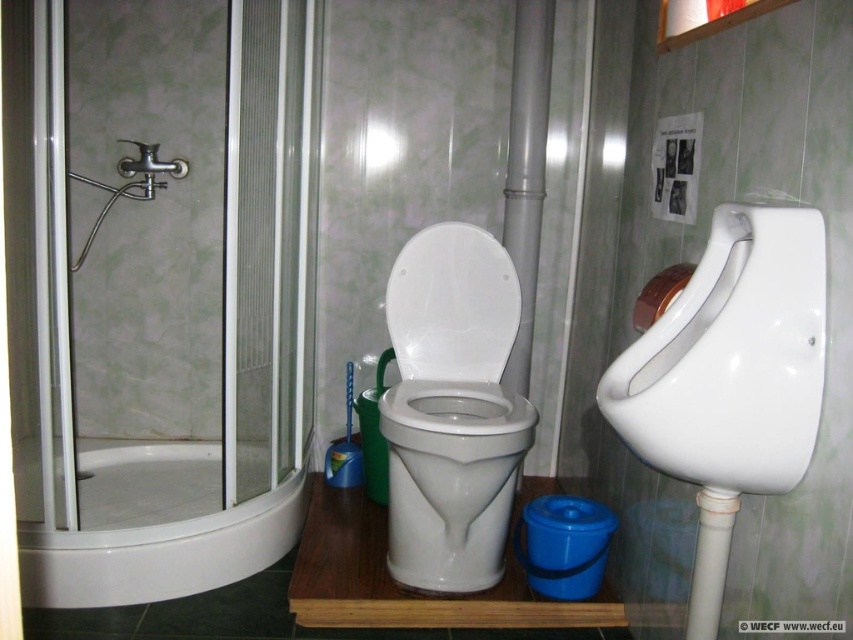
Can you confirm if white glossy toilet bowl at center is wider than brushed metal faucet at upper left?

Yes, white glossy toilet bowl at center is wider than brushed metal faucet at upper left.

Who is positioned more to the right, white glossy toilet bowl at center or brushed metal faucet at upper left?

white glossy toilet bowl at center is more to the right.

Locate an element on the screen. The image size is (853, 640). white glossy toilet bowl at center is located at coordinates pyautogui.click(x=451, y=410).

I want to click on white glossy toilet bowl at center, so click(451, 410).

Is point (474, 253) closer to camera compared to point (189, 589)?

That is False.

Locate an element on the screen. Image resolution: width=853 pixels, height=640 pixels. white glossy toilet bowl at center is located at coordinates (451, 410).

Which is below, white glossy urinal at right or white glossy toilet bowl at center?

Positioned lower is white glossy toilet bowl at center.

Is white glossy urinal at right positioned in front of white glossy toilet bowl at center?

That is True.

The image size is (853, 640). What do you see at coordinates (732, 358) in the screenshot? I see `white glossy urinal at right` at bounding box center [732, 358].

You are a GUI agent. You are given a task and a screenshot of the screen. Output one action in this format:
    pyautogui.click(x=<x>, y=<y>)
    Task: Click on the white glossy urinal at right
    This screenshot has height=640, width=853.
    Given the screenshot: What is the action you would take?
    pyautogui.click(x=732, y=358)